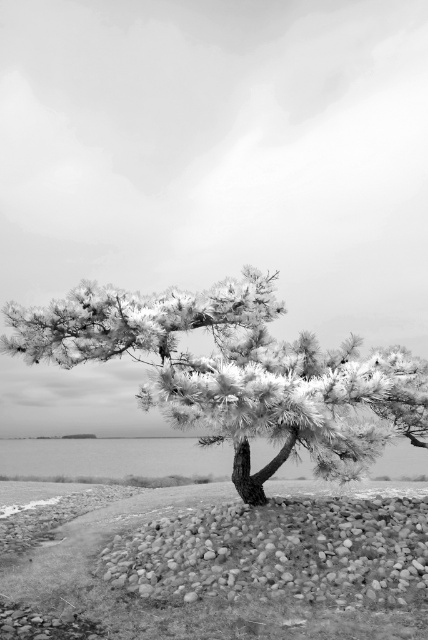
Is frosty pine tree at center thinner than transparent water at center?

Correct, frosty pine tree at center's width is less than transparent water at center's.

Which is below, frosty pine tree at center or transparent water at center?

transparent water at center

Is point (219, 296) closer to camera compared to point (39, 458)?

That is True.

The image size is (428, 640). Identify the location of frosty pine tree at center. (237, 372).

Measure the distance between frosty pine tree at center and smooth pebbles at center.

frosty pine tree at center and smooth pebbles at center are 8.31 feet apart from each other.

Does frosty pine tree at center have a larger size compared to smooth pebbles at center?

Correct, frosty pine tree at center is larger in size than smooth pebbles at center.

The image size is (428, 640). In order to click on frosty pine tree at center in this screenshot , I will do `click(237, 372)`.

Measure the distance between smooth pebbles at center and camera.

smooth pebbles at center is 6.26 meters away from camera.

Image resolution: width=428 pixels, height=640 pixels. Identify the location of smooth pebbles at center. click(279, 552).